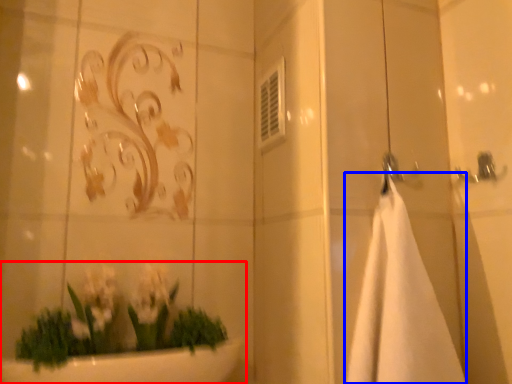
Question: Among these objects, which one is farthest to the camera, houseplant (highlighted by a red box) or bath towel (highlighted by a blue box)?

Choices:
 (A) houseplant
 (B) bath towel

Answer: (A)